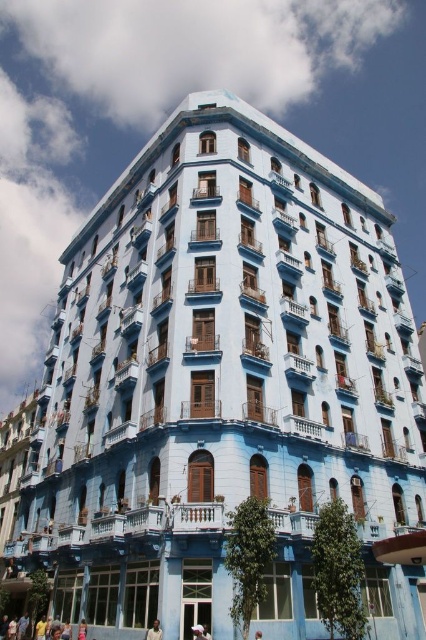
You are a photographer standing in front of the building. You notice two elements in your viewfinder. One is the dark skin smooth face at center and the other is the skinny jeans at lower center. According to the scene, which one is positioned to the right of the other?

The dark skin smooth face at center is positioned to the right of the skinny jeans at lower center.

You are standing in front of the blue building and notice a person in the scene. The person has a dark skin smooth face at center and is wearing skinny jeans at lower center. From your perspective, which part of the person is closer to you?

The dark skin smooth face at center is closer to the viewer than the skinny jeans at lower center.

You are standing in front of the building and notice two items near the entrance. The white fabric at center and the skinny jeans at lower center. Which item takes up more space visually?

The white fabric at center takes up more space visually because it is bigger than the skinny jeans at lower center.